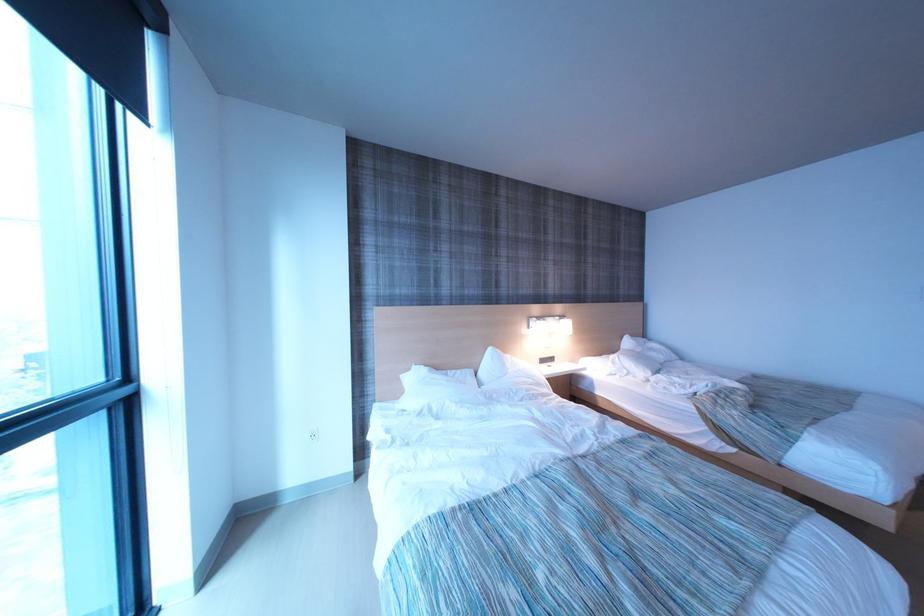
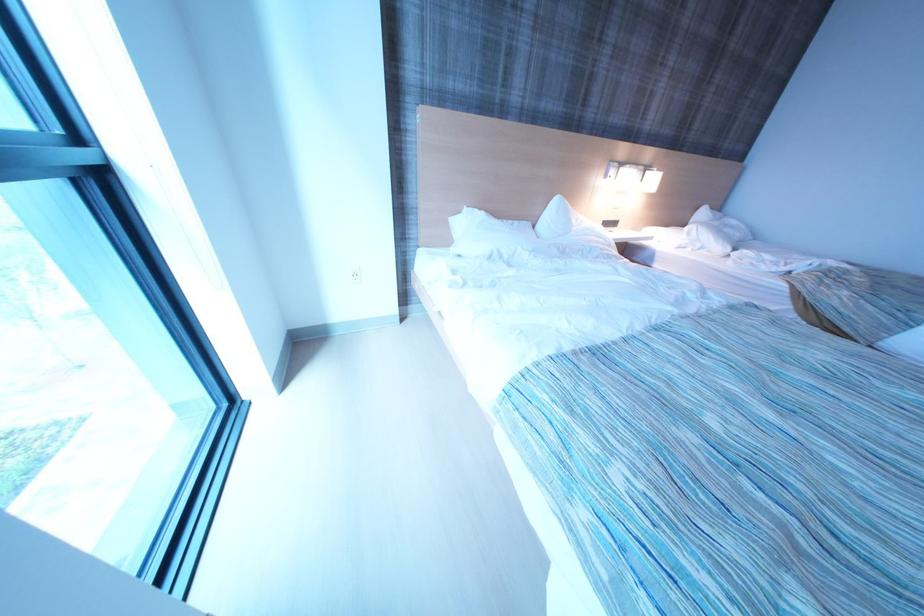
Which direction would the cameraman need to move to produce the second image?

The movement direction of the cameraman is left, forward.